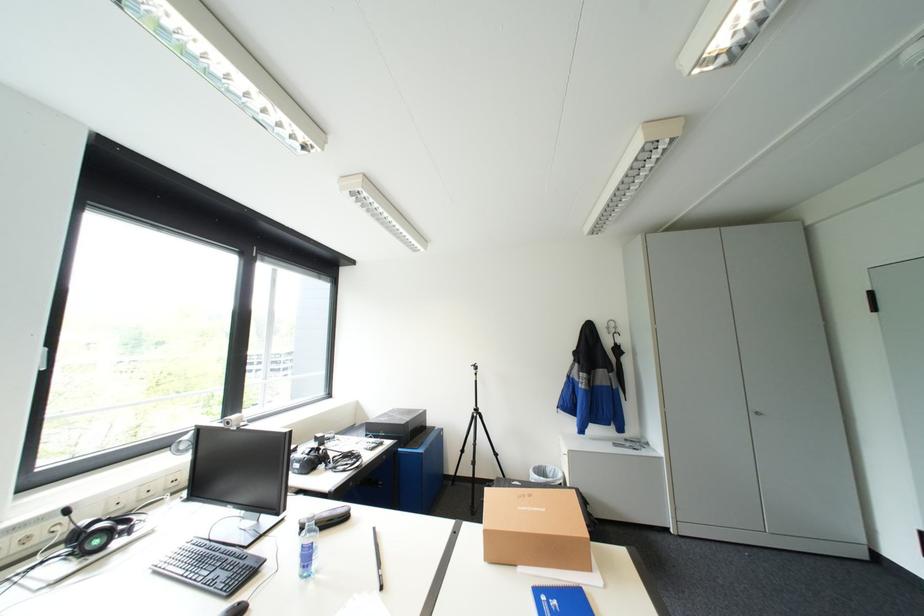
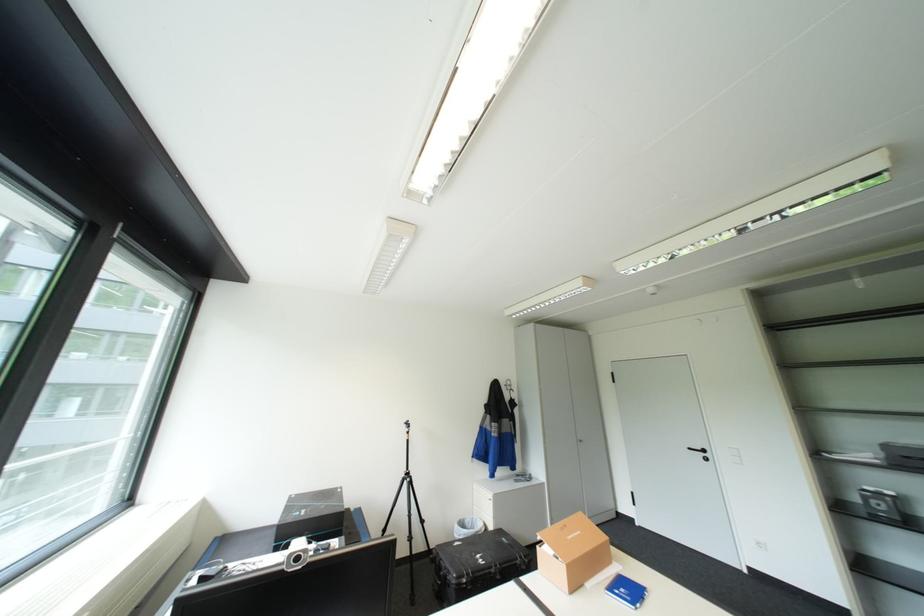
Find the pixel in the second image that matches [480,440] in the first image.

(416, 512)